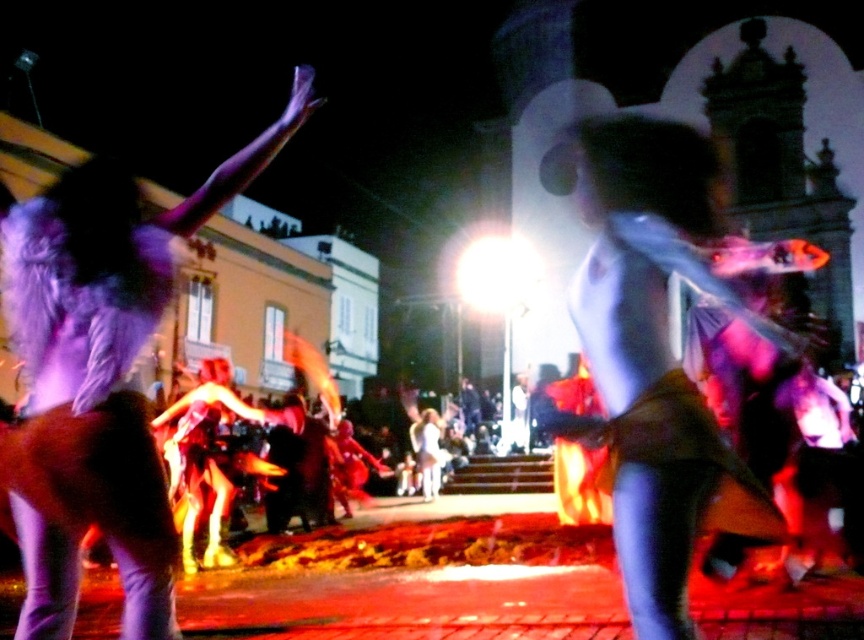
Is matte white dress at center wider than purple feathered wings at upper left?

No, matte white dress at center is not wider than purple feathered wings at upper left.

Who is taller, matte white dress at center or purple feathered wings at upper left?

Standing taller between the two is matte white dress at center.

Is point (618, 243) positioned in front of point (83, 413)?

That is False.

Locate an element on the screen. matte white dress at center is located at coordinates [x=655, y=348].